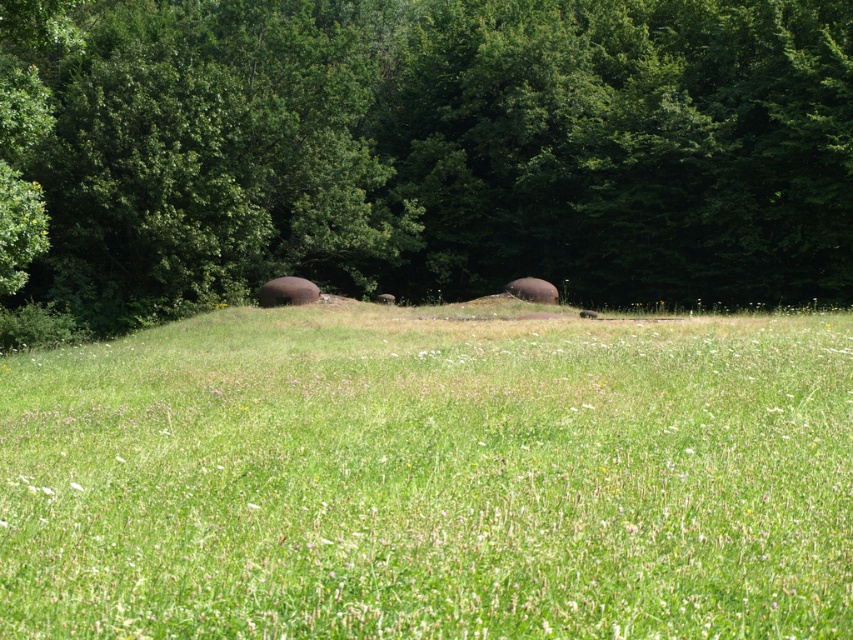
From the picture: Does green grassy field at center have a greater width compared to green leafy tree at upper center?

No, green grassy field at center is not wider than green leafy tree at upper center.

Can you confirm if green grassy field at center is positioned to the right of green leafy tree at upper center?

Yes, green grassy field at center is to the right of green leafy tree at upper center.

Who is more forward, (582, 532) or (618, 179)?

Positioned in front is point (582, 532).

Locate an element on the screen. The image size is (853, 640). green grassy field at center is located at coordinates (430, 477).